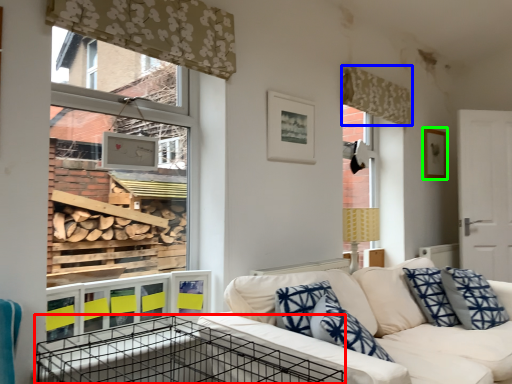
Question: Estimate the real-world distances between objects in this image. Which object is closer to crate (highlighted by a red box), curtain (highlighted by a blue box) or picture frame (highlighted by a green box)?

Choices:
 (A) curtain
 (B) picture frame

Answer: (A)